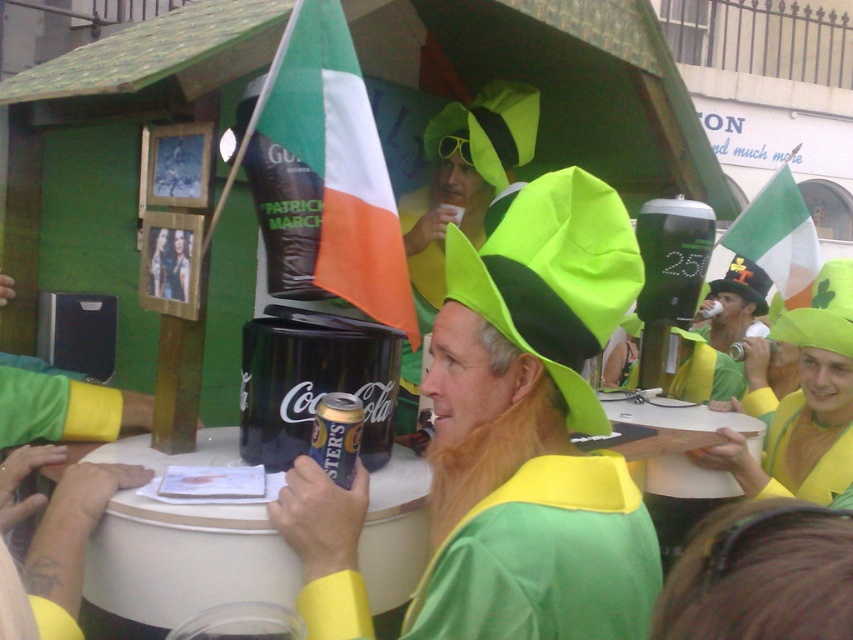
Question: Can you confirm if green fabric flag at upper right is positioned to the left of shiny black hat at center?

Choices:
 (A) yes
 (B) no

Answer: (A)

Question: Among these objects, which one is farthest from the camera?

Choices:
 (A) green fabric flag at upper center
 (B) black plastic can at center
 (C) green matte hat at center
 (D) shiny gold hat at center

Answer: (D)

Question: Is black plastic can at center thinner than metallic silver can at center?

Choices:
 (A) no
 (B) yes

Answer: (A)

Question: Does neon green felt hat at center have a lesser width compared to green fabric flag at upper center?

Choices:
 (A) no
 (B) yes

Answer: (B)

Question: Based on their relative distances, which object is nearer to the green matte hat at center?

Choices:
 (A) metallic silver can at center
 (B) green fabric flag at upper right

Answer: (A)

Question: Which point is farther to the camera?

Choices:
 (A) green fabric flag at upper center
 (B) white plastic table at center
 (C) green matte hat at center
 (D) shiny gold hat at center

Answer: (D)